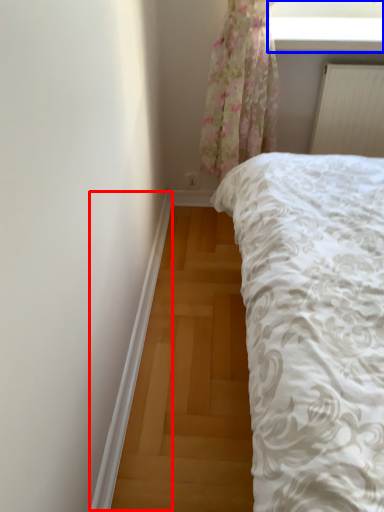
Question: Which of the following is the farthest to the observer, trim (highlighted by a red box) or window screen (highlighted by a blue box)?

Choices:
 (A) trim
 (B) window screen

Answer: (B)